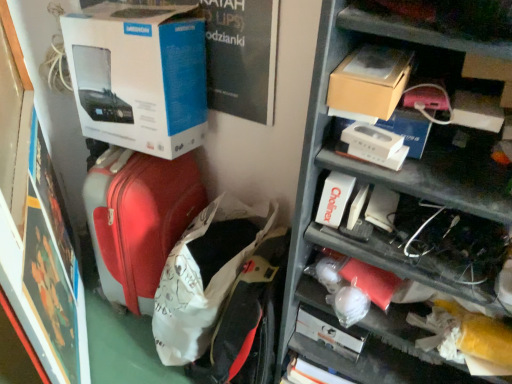
Question: Does point (193, 39) appear closer or farther from the camera than point (312, 107)?

Choices:
 (A) closer
 (B) farther

Answer: (B)

Question: Looking at their shapes, would you say white cardboard box at upper left is wider or thinner than metallic gray shelves at upper right?

Choices:
 (A) thin
 (B) wide

Answer: (A)

Question: Which object is positioned farthest from the white cardboard box at upper left?

Choices:
 (A) brown cardboard box at upper right
 (B) metallic gray shelves at upper right
 (C) matte red suitcase at center
 (D) matte red suitcase at left

Answer: (A)

Question: Which object is the farthest from the matte red suitcase at center?

Choices:
 (A) white cardboard box at upper left
 (B) brown cardboard box at upper right
 (C) metallic gray shelves at upper right
 (D) matte red suitcase at left

Answer: (B)